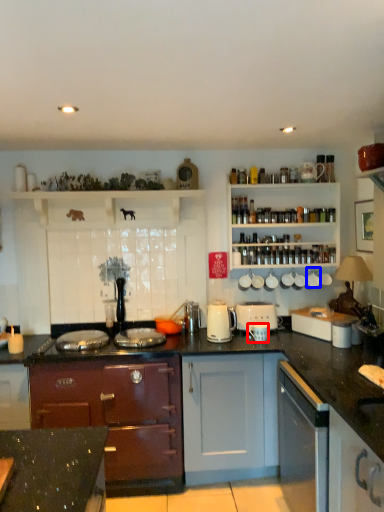
Question: Which of the following is the farthest to the observer, appliance (highlighted by a red box) or appliance (highlighted by a blue box)?

Choices:
 (A) appliance
 (B) appliance

Answer: (B)